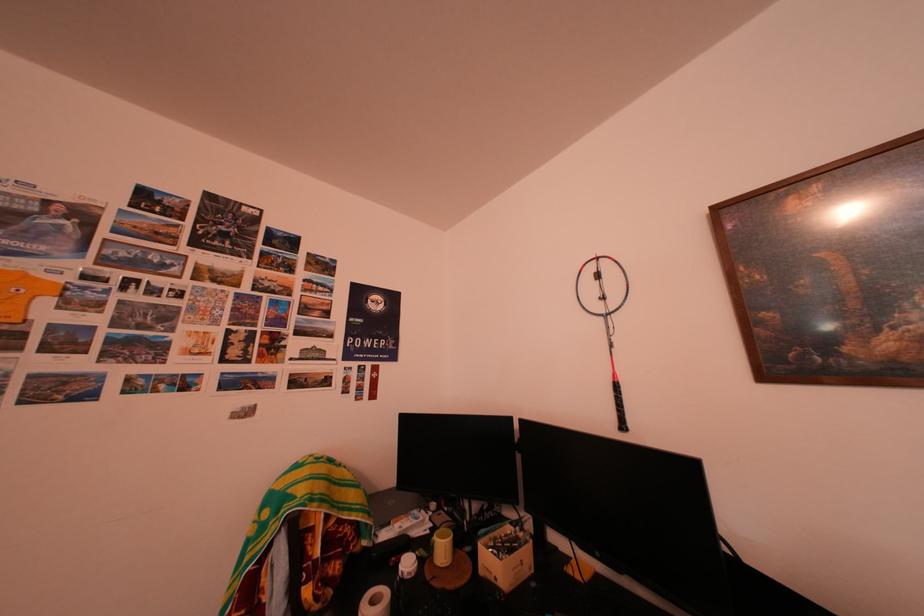
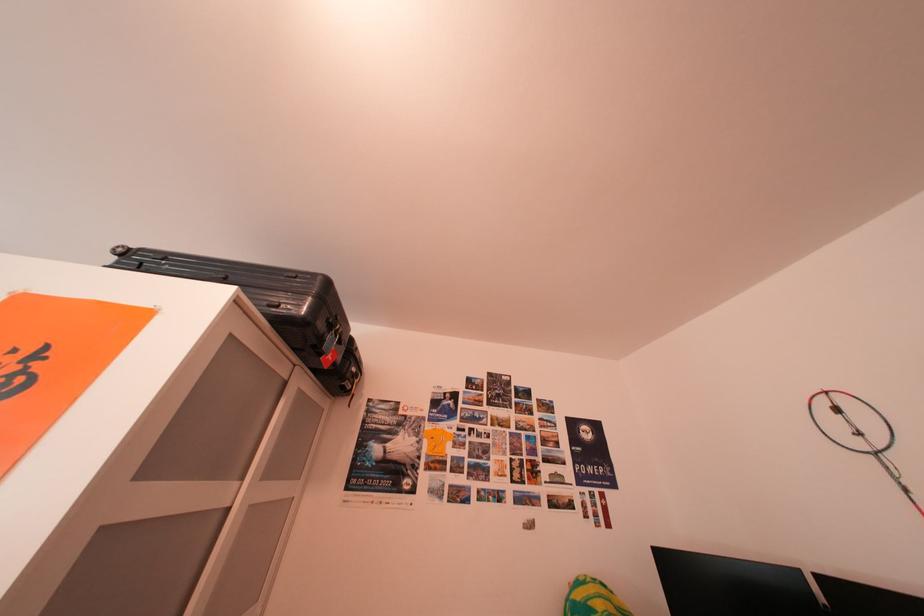
How did the camera likely rotate?

The camera rotated toward left-up.